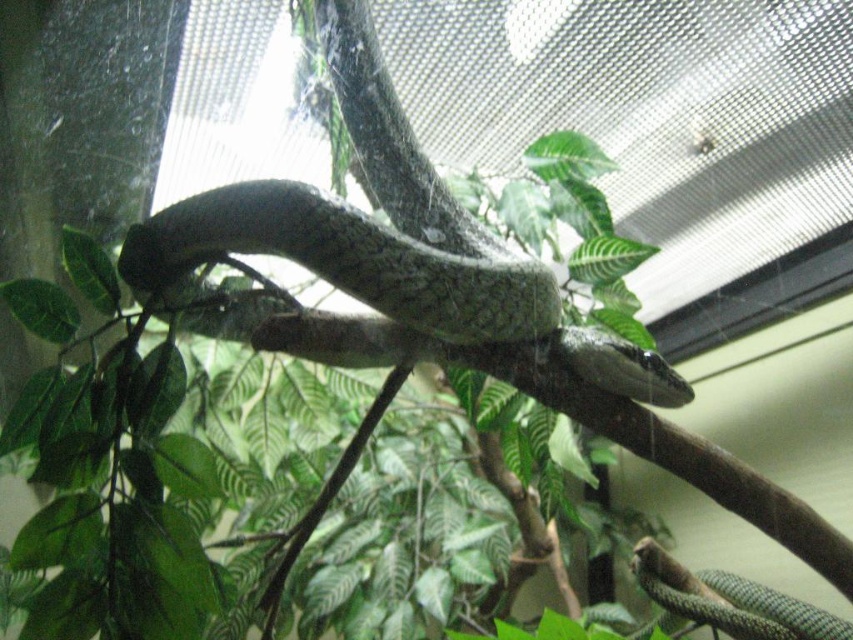
Question: Does green scaly snake at center appear over green glossy snake at lower right?

Choices:
 (A) yes
 (B) no

Answer: (A)

Question: Considering the relative positions of green scaly snake at center and green glossy snake at lower right in the image provided, where is green scaly snake at center located with respect to green glossy snake at lower right?

Choices:
 (A) left
 (B) right

Answer: (A)

Question: Which point is closer to the camera?

Choices:
 (A) green scaly snake at center
 (B) green glossy snake at lower right

Answer: (A)

Question: Which of the following is the closest to the observer?

Choices:
 (A) (340, 68)
 (B) (740, 577)

Answer: (A)

Question: Is green scaly snake at center above green glossy snake at lower right?

Choices:
 (A) yes
 (B) no

Answer: (A)